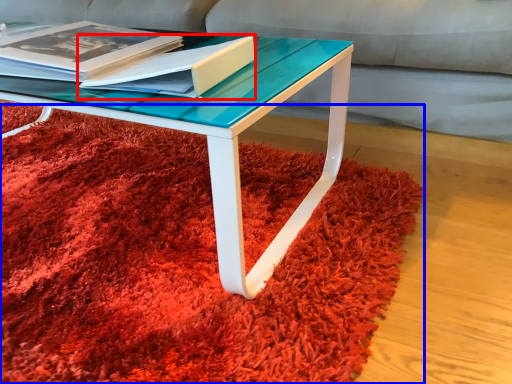
Question: Which point is further to the camera, paperback book (highlighted by a red box) or mat (highlighted by a blue box)?

Choices:
 (A) paperback book
 (B) mat

Answer: (A)